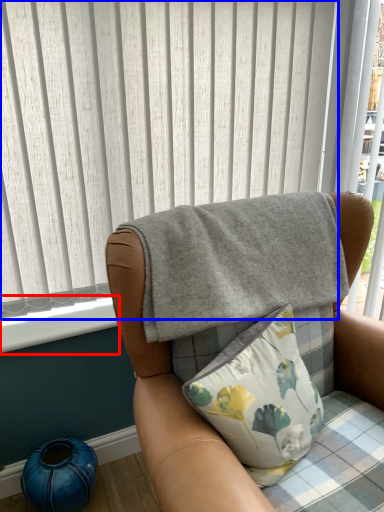
Question: Among these objects, which one is nearest to the camera, window sill (highlighted by a red box) or curtain (highlighted by a blue box)?

Choices:
 (A) window sill
 (B) curtain

Answer: (B)